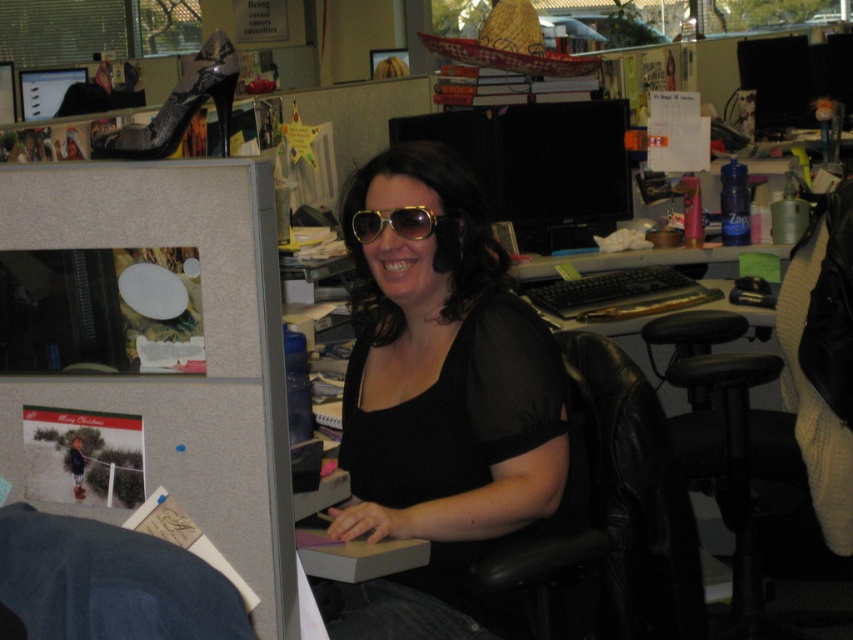
You are standing in the office and want to hand a gift to the woman wearing the matte black shirt at center. If you can reach up to 5 feet, will you be able to reach her?

The matte black shirt at center is 4.61 feet away from the viewer, so yes, you can reach her since your maximum reach is 5 feet.

You are an office worker who needs to place a new plant pot on the desk. The plant pot requires a surface that is taller than the gold textured sunglasses at center. Can the denim swivel chair at lower left provide a suitable surface for this?

The denim swivel chair at lower left has a greater height compared to the gold textured sunglasses at center. Therefore, the denim swivel chair at lower left can provide a suitable surface for the plant pot since its height meets the requirement.

You are an office worker who wants to place both the matte black shirt at center and the gold textured sunglasses at center on a narrow desk tray that can only hold one item at a time. Which item should you place first if you want to ensure both can fit without overlapping?

The matte black shirt at center is wider than the gold textured sunglasses at center, so you should place the narrower gold textured sunglasses at center first to make space for the wider matte black shirt at center.